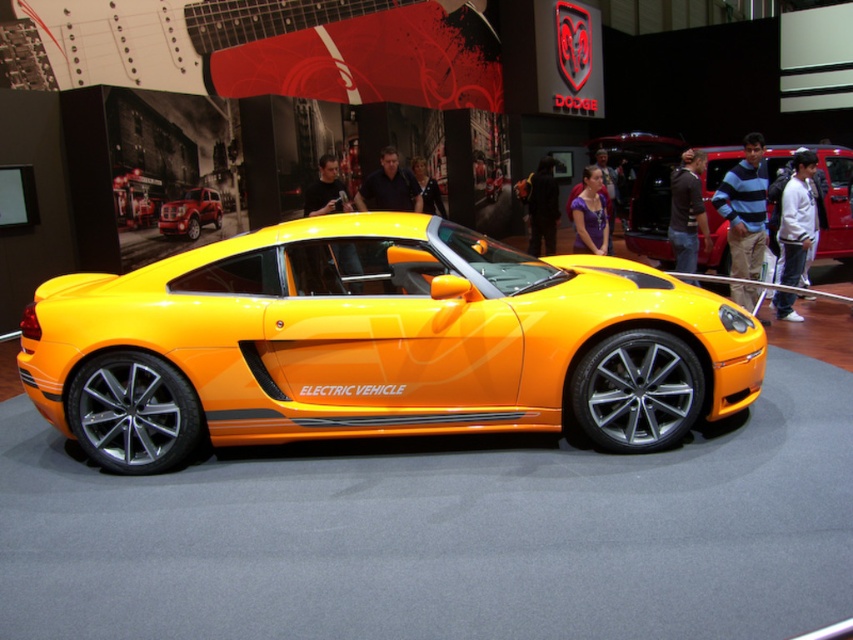
Which of these two, shiny orange electric vehicle at center or shiny metallic car at center, stands shorter?

shiny orange electric vehicle at center is shorter.

Where is `shiny orange electric vehicle at center`? This screenshot has height=640, width=853. shiny orange electric vehicle at center is located at coordinates (376, 342).

In order to click on shiny orange electric vehicle at center in this screenshot , I will do `click(376, 342)`.

Describe the element at coordinates (645, 188) in the screenshot. This screenshot has height=640, width=853. I see `shiny metallic car at center` at that location.

Does shiny metallic car at center appear on the right side of shiny red suv at center?

Correct, you'll find shiny metallic car at center to the right of shiny red suv at center.

Who is more forward, (720, 259) or (193, 237)?

Positioned in front is point (193, 237).

The width and height of the screenshot is (853, 640). Identify the location of shiny metallic car at center. (645, 188).

Who is lower down, shiny orange electric vehicle at center or shiny red suv at center?

Positioned lower is shiny orange electric vehicle at center.

Which is more to the left, shiny orange electric vehicle at center or shiny red suv at center?

shiny red suv at center

Where is `shiny orange electric vehicle at center`? shiny orange electric vehicle at center is located at coordinates click(x=376, y=342).

You are a GUI agent. You are given a task and a screenshot of the screen. Output one action in this format:
    pyautogui.click(x=<x>, y=<y>)
    Task: Click on the shiny orange electric vehicle at center
    
    Given the screenshot: What is the action you would take?
    pyautogui.click(x=376, y=342)